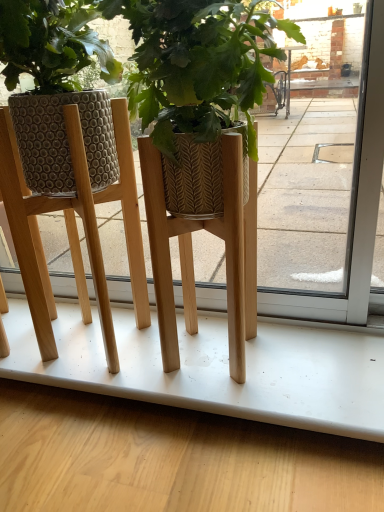
The height and width of the screenshot is (512, 384). What are the coordinates of `blank space situated above wooden floor at lower center (from a real-world perspective)` in the screenshot? It's located at (153, 350).